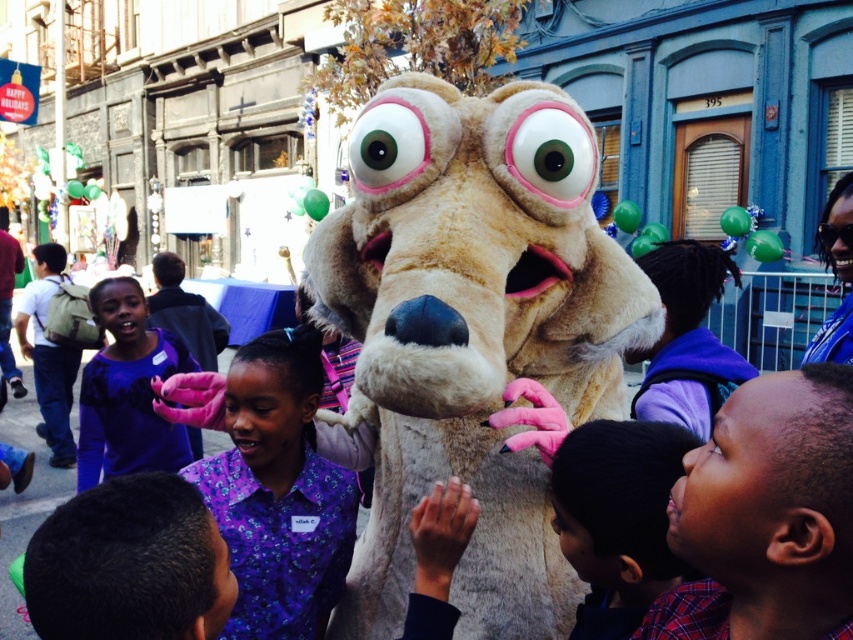
Can you confirm if smooth purple shirt at lower right is thinner than purple fabric shirt at center?

Yes.

Is point (654, 499) behind point (83, 408)?

No, (654, 499) is in front of (83, 408).

The image size is (853, 640). I want to click on smooth purple shirt at lower right, so click(618, 518).

Which is above, purple floral shirt at center or purple fabric shirt at center?

purple fabric shirt at center is above.

Between point (260, 422) and point (103, 305), which one is positioned behind?

Point (103, 305)

Who is more forward, (235, 403) or (91, 444)?

Point (235, 403)

Locate an element on the screen. purple floral shirt at center is located at coordinates [x=277, y=492].

Between point (489, 346) and point (650, 552), which one is positioned behind?

The point (489, 346) is behind.

Does fluffy beige costume at center have a larger size compared to smooth purple shirt at lower right?

Incorrect, fluffy beige costume at center is not larger than smooth purple shirt at lower right.

Is point (350, 164) positioned before point (630, 467)?

That is False.

I want to click on fluffy beige costume at center, so click(471, 332).